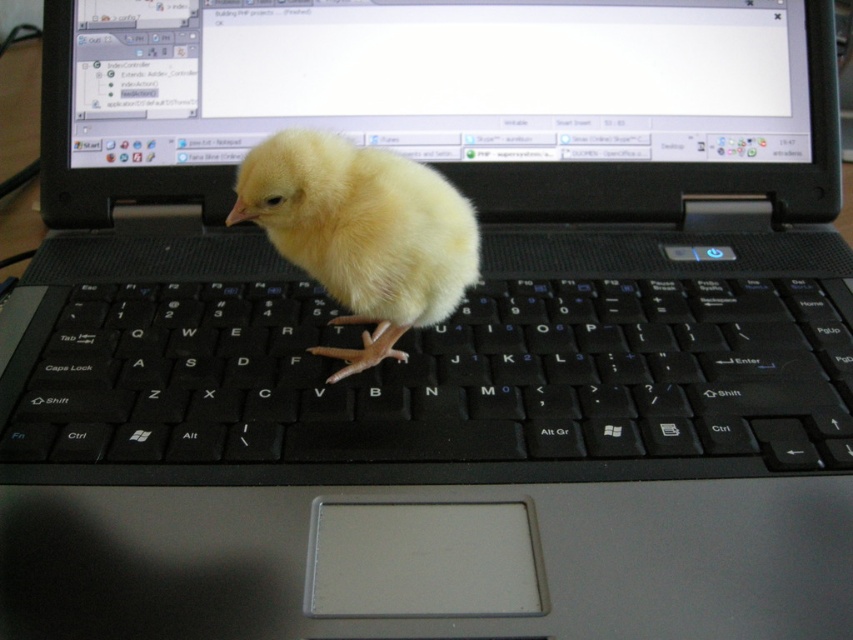
You are trying to determine if the matte plastic screen at upper center can fit a sticker that requires 10 cm in height. Given the height of the yellow fluffy chick at center, can you estimate if the screen is tall enough?

The matte plastic screen at upper center is not as tall as the yellow fluffy chick at center. Since the chick is taller than the screen, the screen might not be tall enough to accommodate a 10 cm tall sticker unless the chick is shorter than 10 cm, but we don

You are trying to determine which point is closer to you in the image. You see the point at coordinates point (271, 320) and the point at coordinates point (341, 273). Which point is closer to you?

Point (271, 320) is further to the viewer than point (341, 273), so the closer point to you is point (341, 273).